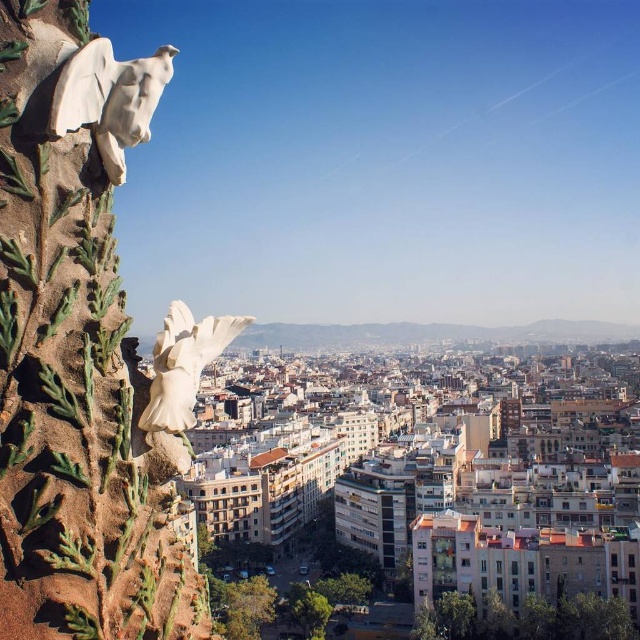
Question: Which point is closer to the camera?

Choices:
 (A) (168, 422)
 (B) (154, 76)

Answer: (B)

Question: Does white stone eagle at upper left have a greater width compared to white glossy bird at upper left?

Choices:
 (A) no
 (B) yes

Answer: (A)

Question: Does white stone eagle at upper left have a larger size compared to white glossy bird at upper left?

Choices:
 (A) yes
 (B) no

Answer: (B)

Question: Is white stone eagle at upper left positioned at the back of white glossy bird at upper left?

Choices:
 (A) yes
 (B) no

Answer: (B)